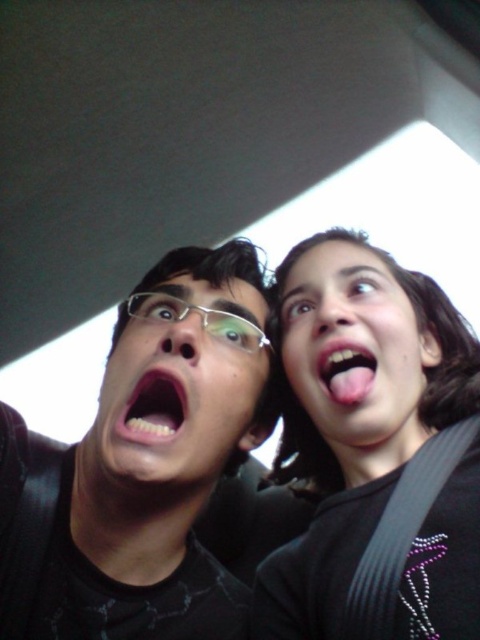
You are taking a photo of two people from a low angle. You notice the black matte glasses at upper left and the smooth skin face at upper right. Which object is closer to the bottom of the image?

The black matte glasses at upper left is below the smooth skin face at upper right, so it is closer to the bottom of the image.

You are a photographer trying to capture a closeup shot of the pink glossy teeth at center. You are currently standing 1 meter away from the teeth. If you want to get closer to make the teeth fill the frame, should you move forward or backward?

The pink glossy teeth at center and viewer are 51.98 centimeters apart. Since you are currently 1 meter away, which is farther than the 51.98 cm distance required, you should move forward to get closer to the pink glossy teeth at center.